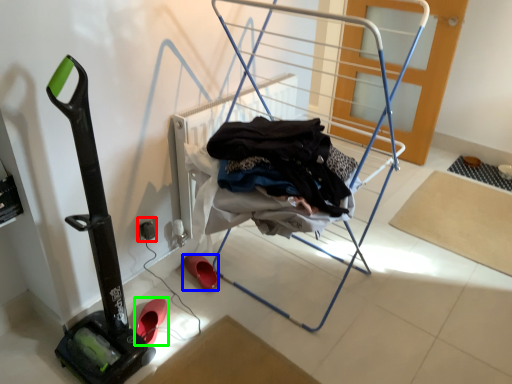
Question: Which object is the closest to the electric outlet (highlighted by a red box)? Choose among these: footwear (highlighted by a blue box) or footwear (highlighted by a green box).

Choices:
 (A) footwear
 (B) footwear

Answer: (A)